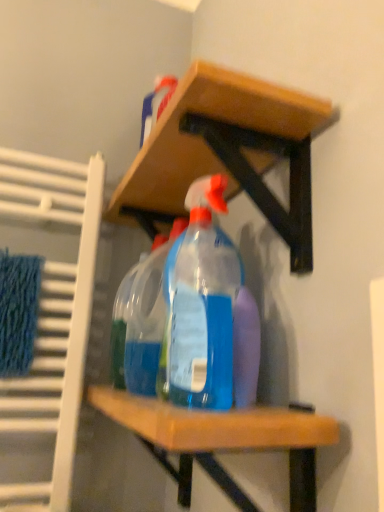
Measure the distance between wooden shelf at upper center and camera.

A distance of 19.60 inches exists between wooden shelf at upper center and camera.

Describe the element at coordinates (18, 311) in the screenshot. The width and height of the screenshot is (384, 512). I see `blue knitted bath towel at left` at that location.

I want to click on transparent plastic spray bottle at center, which appears as the second bottle when viewed from the back, so click(200, 305).

Where is `transparent plastic spray bottle at center, which ranks as the 1th bottle in back-to-front order`? This screenshot has height=512, width=384. transparent plastic spray bottle at center, which ranks as the 1th bottle in back-to-front order is located at coordinates (147, 319).

Which object is thinner, wooden shelf at upper center or transparent plastic spray bottle at center, marked as the first bottle in a front-to-back arrangement?

transparent plastic spray bottle at center, marked as the first bottle in a front-to-back arrangement, is thinner.

Can you tell me how much wooden shelf at upper center and transparent plastic spray bottle at center, which appears as the second bottle when viewed from the back, differ in facing direction?

They differ by 26 degrees in their facing directions.

From a real-world perspective, which is physically above, wooden shelf at upper center or transparent plastic spray bottle at center, which appears as the second bottle when viewed from the back?

From a 3D spatial view, wooden shelf at upper center is above.

At what (x,y) coordinates should I click in order to perform the action: click on bottle on the right of wooden shelf at upper center. Please return your answer as a coordinate pair (x, y). This screenshot has width=384, height=512. Looking at the image, I should click on (x=200, y=305).

Which is more to the right, blue knitted bath towel at left or wooden shelf at upper center?

wooden shelf at upper center is more to the right.

Based on the photo, which point is more distant from viewer, [21,290] or [268,97]?

Point [21,290]

In order to click on bath towel on the left of wooden shelf at upper center in this screenshot , I will do `click(18, 311)`.

Is blue knitted bath towel at left looking in the opposite direction of wooden shelf at upper center?

That's not correct — blue knitted bath towel at left is not looking away from wooden shelf at upper center.

Looking at this image, is the position of transparent plastic spray bottle at center, which ranks as the 1th bottle in back-to-front order, less distant than that of wooden shelf at upper center?

No.

Is transparent plastic spray bottle at center, which ranks as the 1th bottle in back-to-front order, next to wooden shelf at upper center and touching it?

No, transparent plastic spray bottle at center, which ranks as the 1th bottle in back-to-front order, is not making contact with wooden shelf at upper center.

From their relative heights in the image, would you say transparent plastic spray bottle at center, which ranks as the 1th bottle in back-to-front order, is taller or shorter than wooden shelf at upper center?

Clearly, transparent plastic spray bottle at center, which ranks as the 1th bottle in back-to-front order, is taller compared to wooden shelf at upper center.

From the image's perspective, between transparent plastic spray bottle at center, which appears as the second bottle when viewed from the back, and transparent plastic spray bottle at center, the 2th bottle when ordered from front to back, who is located below?

From the image's view, transparent plastic spray bottle at center, the 2th bottle when ordered from front to back, is below.

From a real-world perspective, is transparent plastic spray bottle at center, marked as the first bottle in a front-to-back arrangement, physically located above or below transparent plastic spray bottle at center, the 2th bottle when ordered from front to back?

From a real-world perspective, transparent plastic spray bottle at center, marked as the first bottle in a front-to-back arrangement, is physically above transparent plastic spray bottle at center, the 2th bottle when ordered from front to back.

Considering the relative positions of transparent plastic spray bottle at center, marked as the first bottle in a front-to-back arrangement, and transparent plastic spray bottle at center, which ranks as the 1th bottle in back-to-front order, in the image provided, is transparent plastic spray bottle at center, marked as the first bottle in a front-to-back arrangement, behind transparent plastic spray bottle at center, which ranks as the 1th bottle in back-to-front order,?

That is False.

Is blue knitted bath towel at left not within transparent plastic spray bottle at center, which appears as the second bottle when viewed from the back?

blue knitted bath towel at left is positioned outside transparent plastic spray bottle at center, which appears as the second bottle when viewed from the back.

Is blue knitted bath towel at left to the left of transparent plastic spray bottle at center, marked as the first bottle in a front-to-back arrangement, from the viewer's perspective?

Yes, blue knitted bath towel at left is to the left of transparent plastic spray bottle at center, marked as the first bottle in a front-to-back arrangement.

Which of these two, blue knitted bath towel at left or transparent plastic spray bottle at center, which appears as the second bottle when viewed from the back, is smaller?

With smaller size is blue knitted bath towel at left.

Is blue knitted bath towel at left thinner than transparent plastic spray bottle at center, which appears as the second bottle when viewed from the back?

Correct, the width of blue knitted bath towel at left is less than that of transparent plastic spray bottle at center, which appears as the second bottle when viewed from the back.

Is transparent plastic spray bottle at center, which appears as the second bottle when viewed from the back, smaller than blue knitted bath towel at left?

No.

Is transparent plastic spray bottle at center, which appears as the second bottle when viewed from the back, shorter than blue knitted bath towel at left?

No.

Which object is further away from the camera, transparent plastic spray bottle at center, marked as the first bottle in a front-to-back arrangement, or blue knitted bath towel at left?

Positioned behind is blue knitted bath towel at left.

The height and width of the screenshot is (512, 384). I want to click on bath towel on the left of transparent plastic spray bottle at center, marked as the first bottle in a front-to-back arrangement, so click(18, 311).

Is blue knitted bath towel at left not near transparent plastic spray bottle at center, which ranks as the 1th bottle in back-to-front order?

They are positioned close to each other.

From a real-world perspective, who is located lower, blue knitted bath towel at left or transparent plastic spray bottle at center, which ranks as the 1th bottle in back-to-front order?

blue knitted bath towel at left.

Measure the distance from blue knitted bath towel at left to transparent plastic spray bottle at center, the 2th bottle when ordered from front to back.

24.96 centimeters.

Considering the positions of point (3, 275) and point (161, 309), is point (3, 275) closer or farther from the camera than point (161, 309)?

Point (3, 275) is positioned farther from the camera compared to point (161, 309).

Locate an element on the screen. shelf above the transparent plastic spray bottle at center, marked as the first bottle in a front-to-back arrangement (from a real-world perspective) is located at coordinates (227, 153).

This screenshot has width=384, height=512. I want to click on shelf that is in front of the blue knitted bath towel at left, so click(227, 153).

Based on their spatial positions, is blue knitted bath towel at left or transparent plastic spray bottle at center, marked as the first bottle in a front-to-back arrangement, further from wooden shelf at upper center?

blue knitted bath towel at left is positioned further to the anchor wooden shelf at upper center.

Estimate the real-world distances between objects in this image. Which object is further from transparent plastic spray bottle at center, which appears as the second bottle when viewed from the back, blue knitted bath towel at left or transparent plastic spray bottle at center, which ranks as the 1th bottle in back-to-front order?

Based on the image, blue knitted bath towel at left appears to be further to transparent plastic spray bottle at center, which appears as the second bottle when viewed from the back.

Estimate the real-world distances between objects in this image. Which object is closer to wooden shelf at upper center, transparent plastic spray bottle at center, which appears as the second bottle when viewed from the back, or blue knitted bath towel at left?

transparent plastic spray bottle at center, which appears as the second bottle when viewed from the back, lies closer to wooden shelf at upper center than the other object.

From the image, which object appears to be nearer to transparent plastic spray bottle at center, the 2th bottle when ordered from front to back, transparent plastic spray bottle at center, marked as the first bottle in a front-to-back arrangement, or wooden shelf at upper center?

The object closer to transparent plastic spray bottle at center, the 2th bottle when ordered from front to back, is transparent plastic spray bottle at center, marked as the first bottle in a front-to-back arrangement.

Which object lies nearer to the anchor point blue knitted bath towel at left, transparent plastic spray bottle at center, which ranks as the 1th bottle in back-to-front order, or transparent plastic spray bottle at center, marked as the first bottle in a front-to-back arrangement?

transparent plastic spray bottle at center, which ranks as the 1th bottle in back-to-front order, is positioned closer to the anchor blue knitted bath towel at left.

Based on their spatial positions, is transparent plastic spray bottle at center, which ranks as the 1th bottle in back-to-front order, or wooden shelf at upper center closer to blue knitted bath towel at left?

transparent plastic spray bottle at center, which ranks as the 1th bottle in back-to-front order.

Looking at the image, which one is located closer to wooden shelf at upper center, transparent plastic spray bottle at center, which ranks as the 1th bottle in back-to-front order, or transparent plastic spray bottle at center, marked as the first bottle in a front-to-back arrangement?

transparent plastic spray bottle at center, marked as the first bottle in a front-to-back arrangement.

Which object lies nearer to the anchor point wooden shelf at upper center, transparent plastic spray bottle at center, which ranks as the 1th bottle in back-to-front order, or blue knitted bath towel at left?

The object closer to wooden shelf at upper center is transparent plastic spray bottle at center, which ranks as the 1th bottle in back-to-front order.

The width and height of the screenshot is (384, 512). Identify the location of bottle between blue knitted bath towel at left and transparent plastic spray bottle at center, marked as the first bottle in a front-to-back arrangement, in the horizontal direction. (147, 319).

This screenshot has width=384, height=512. In order to click on shelf situated between blue knitted bath towel at left and transparent plastic spray bottle at center, marked as the first bottle in a front-to-back arrangement, from left to right in this screenshot , I will do `click(227, 153)`.

Where is `bottle situated between blue knitted bath towel at left and wooden shelf at upper center from left to right`? This screenshot has height=512, width=384. bottle situated between blue knitted bath towel at left and wooden shelf at upper center from left to right is located at coordinates (147, 319).

The width and height of the screenshot is (384, 512). Identify the location of bottle between wooden shelf at upper center and transparent plastic spray bottle at center, the 2th bottle when ordered from front to back, along the z-axis. (200, 305).